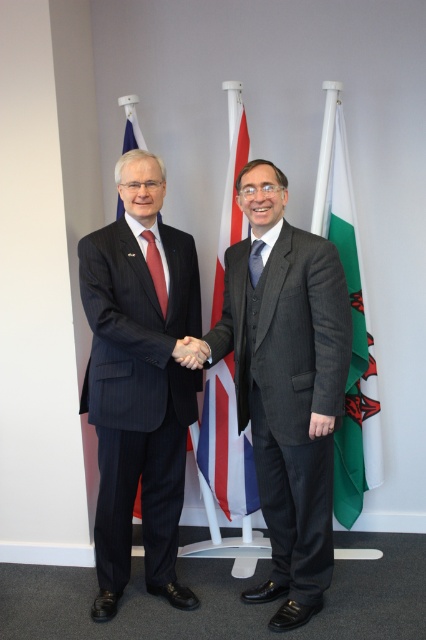
You are a photographer adjusting the camera focus. The matte red tie at center and the black matte hand at center are both in the frame. Which object should you focus on first if you want to ensure the thinner one is sharp?

The matte red tie at center is thinner than the black matte hand at center, so you should focus on the matte red tie at center first to ensure it is sharp.

Looking at this image, you are a photographer at a diplomatic event. You need to capture a clear photo of the dark blue silk tie at center and the green fabric flag at right. However, the flag is partially blocking the tie. Can you adjust your position to see both objects fully without moving them?

The dark blue silk tie at center is behind the green fabric flag at right, so moving your position slightly to the side might allow you to see both objects fully without obstruction.